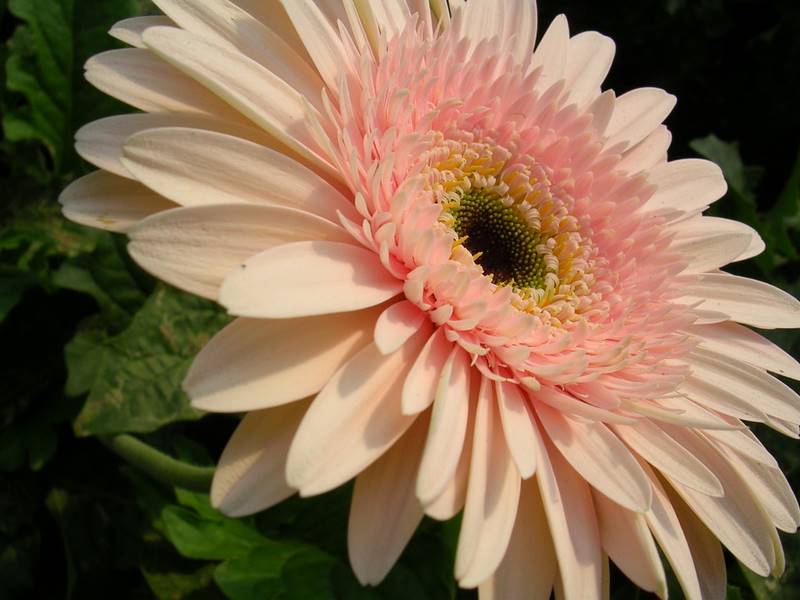
Locate an element on the screen. The height and width of the screenshot is (600, 800). plant is located at coordinates (78, 389).